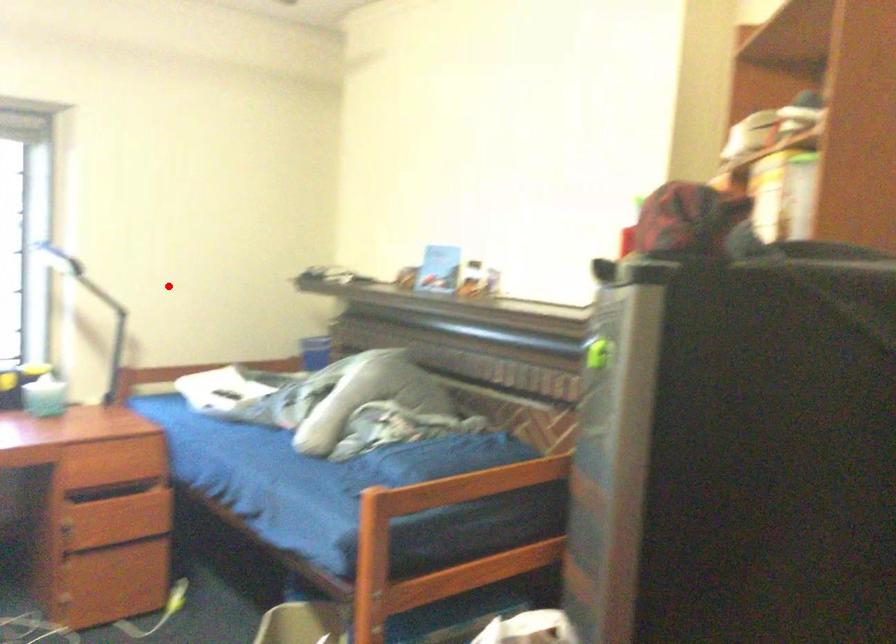
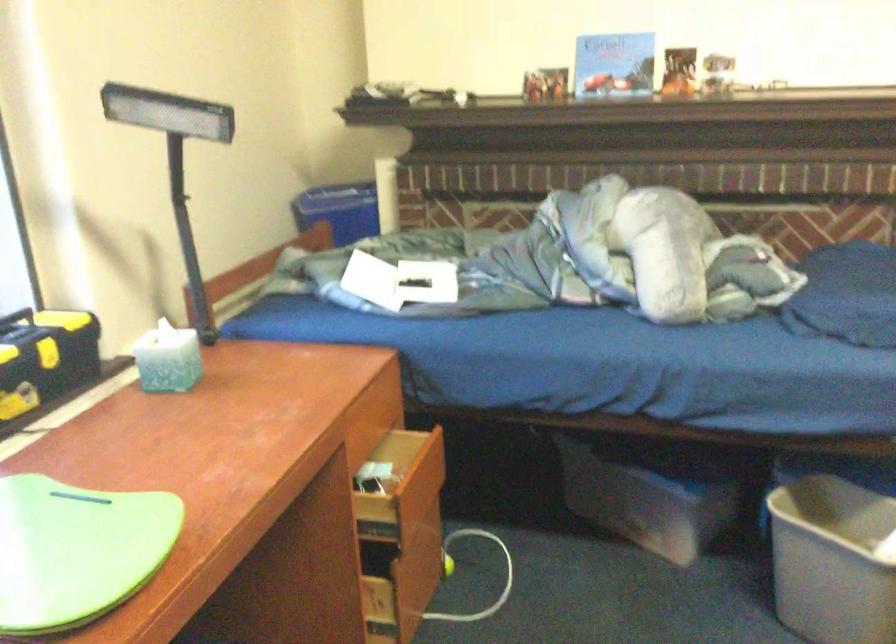
Question: I am providing you with two images of the same scene from different viewpoints. In image1, a red point is highlighted. Considering the same 3D point in image2, which of the following is correct?

Choices:
 (A) It is closer
 (B) It is farther

Answer: (A)